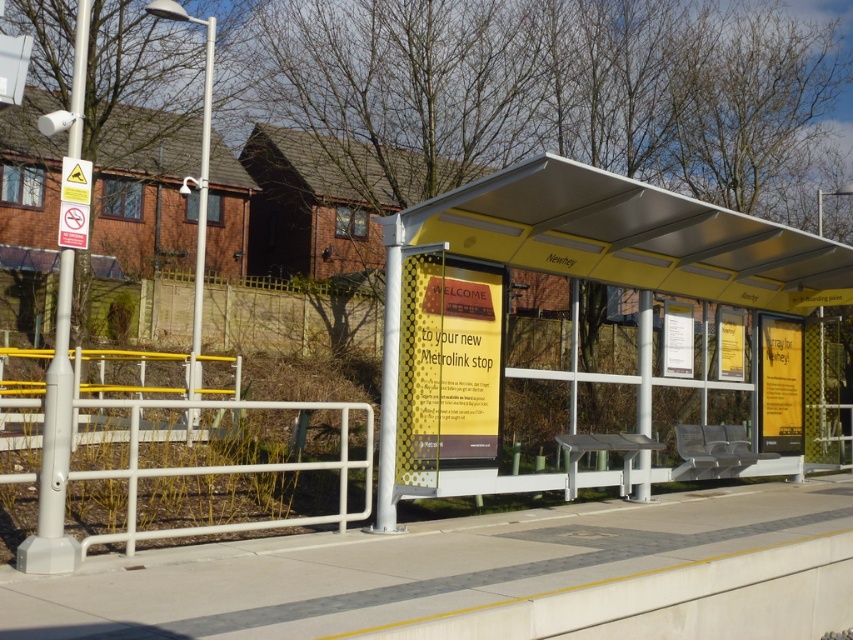
You are a pedestrian approaching the metallic yellow bus stop at center and the metallic yellow canopy at center. Which one will you encounter first?

The metallic yellow bus stop at center is in front of the metallic yellow canopy at center, so you will encounter the metallic yellow bus stop at center first.

You are a pedestrian standing at the bus stop shelter. You want to take a photo of the brick wall at left without including the metallic yellow canopy at center in the frame. Is it possible to do so while staying within the shelter area?

The metallic yellow canopy at center is positioned over brick wall at left, so the canopy is blocking the view of the brick wall at left. Therefore, it is not possible to take a photo of the brick wall at left without including the metallic yellow canopy at center in the frame while staying within the shelter area.

You are standing at point (578, 330). Which object is exactly at your current location?

The metallic yellow bus stop at center is exactly at your current location at point (578, 330).